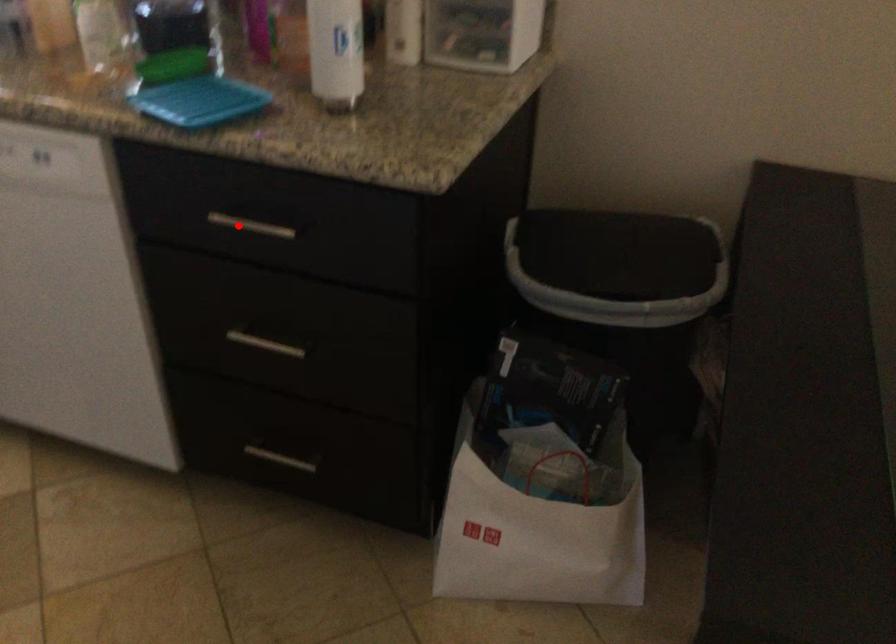
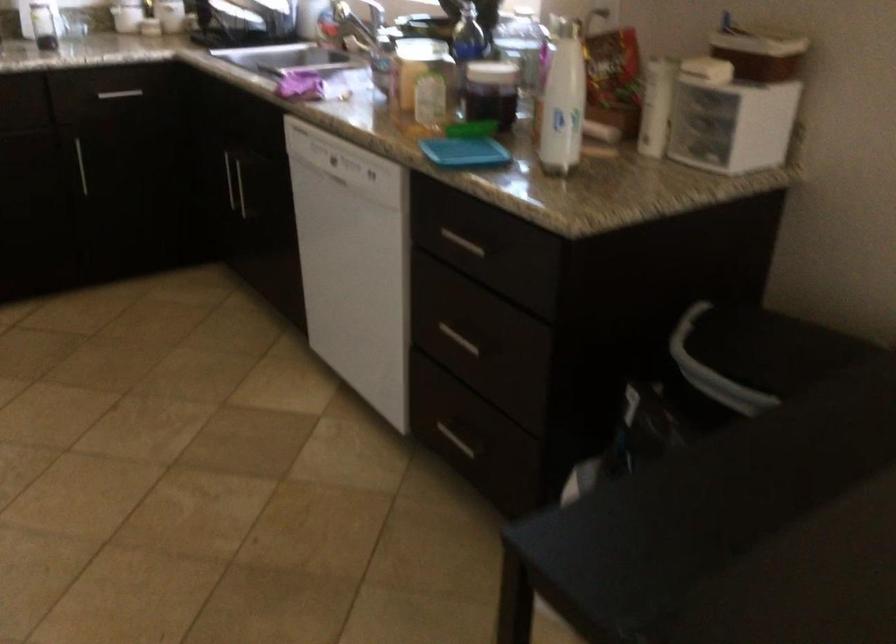
Question: I am providing you with two images of the same scene from different viewpoints. A red point is shown in image1. For the corresponding object point in image2, is it positioned nearer or farther from the camera?

Choices:
 (A) Nearer
 (B) Farther

Answer: (B)